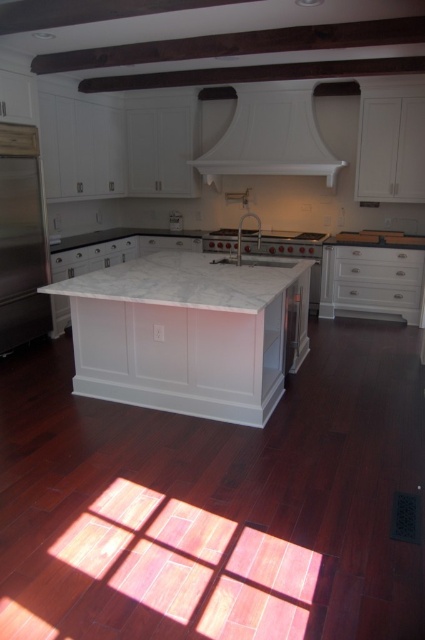
You are a chef preparing to place a large pot on the white marble countertop at center. However, you notice the stainless steel refrigerator at left is in the way. Can you move the pot to the countertop without moving the refrigerator?

The white marble countertop at center is below the stainless steel refrigerator at left, so the refrigerator is positioned above the countertop. This means the refrigerator does not block access to the countertop, so the pot can be placed there without moving the refrigerator.

You are a kitchen designer planning to install a new light fixture. You need to know the position of the white matte exhaust hood at upper center to avoid obstruction. Can you tell me its coordinates?

The white matte exhaust hood at upper center is located at point (271,136).

You are planning to install a new microwave above the stove in this kitchen. The microwave requires a minimum of 60 cm of width to fit. Given the white matte exhaust hood at upper center and the stainless steel refrigerator at left, which one has sufficient width to accommodate the microwave?

The white matte exhaust hood at upper center has a larger width than the stainless steel refrigerator at left, so it can accommodate the microwave if its width meets or exceeds 60 cm. However, the exact width isn generated in the provided information, so we cannot confirm definitively.